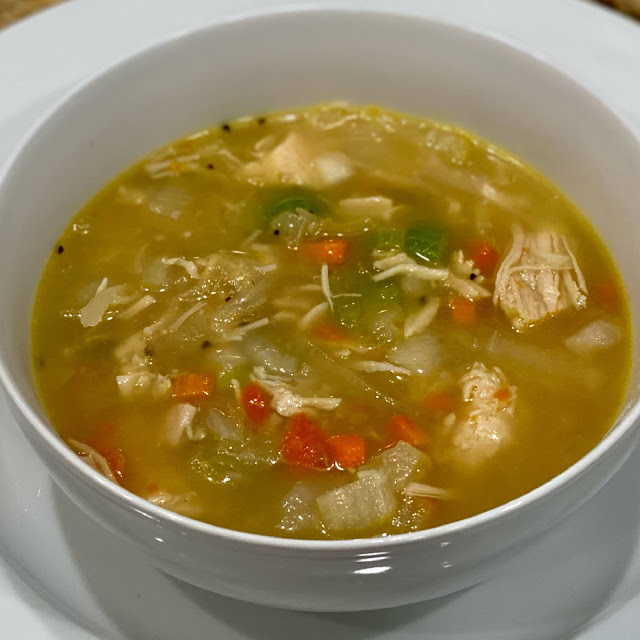
At what (x,y) coordinates should I click in order to perform the action: click on top edge of bowl. Please return your answer as a coordinate pair (x, y). The height and width of the screenshot is (640, 640). Looking at the image, I should click on (19, 399), (116, 488), (272, 540), (452, 525), (591, 454).